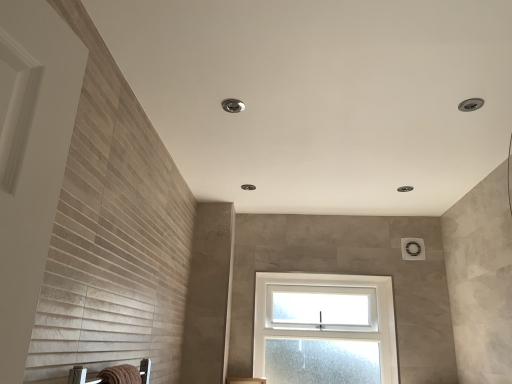
The height and width of the screenshot is (384, 512). What do you see at coordinates (325, 314) in the screenshot?
I see `clear glass window at center` at bounding box center [325, 314].

The image size is (512, 384). I want to click on clear glass window at center, so click(x=325, y=314).

The image size is (512, 384). Describe the element at coordinates (120, 375) in the screenshot. I see `brown textured towel at lower left` at that location.

You are a GUI agent. You are given a task and a screenshot of the screen. Output one action in this format:
    pyautogui.click(x=<x>, y=<y>)
    Task: Click on the brown textured towel at lower left
    The width and height of the screenshot is (512, 384).
    Given the screenshot: What is the action you would take?
    pyautogui.click(x=120, y=375)

Locate an element on the screen. The image size is (512, 384). clear glass window at center is located at coordinates (325, 314).

In the image, is brown textured towel at lower left on the left side or the right side of clear glass window at center?

brown textured towel at lower left is to the left of clear glass window at center.

Is brown textured towel at lower left behind clear glass window at center?

No, brown textured towel at lower left is in front of clear glass window at center.

Considering the points (110, 374) and (375, 278), which point is in front, point (110, 374) or point (375, 278)?

The point (110, 374) is closer to the camera.

From the image's perspective, which one is positioned higher, brown textured towel at lower left or clear glass window at center?

brown textured towel at lower left.

From a real-world perspective, relative to clear glass window at center, is brown textured towel at lower left vertically above or below?

In terms of real-world spatial position, brown textured towel at lower left is below clear glass window at center.

In terms of width, does brown textured towel at lower left look wider or thinner when compared to clear glass window at center?

Clearly, brown textured towel at lower left has less width compared to clear glass window at center.

Does brown textured towel at lower left have a lesser height compared to clear glass window at center?

Yes, brown textured towel at lower left is shorter than clear glass window at center.

Is brown textured towel at lower left bigger or smaller than clear glass window at center?

Considering their sizes, brown textured towel at lower left takes up less space than clear glass window at center.

Is brown textured towel at lower left inside the boundaries of clear glass window at center, or outside?

brown textured towel at lower left lies outside clear glass window at center.

Are brown textured towel at lower left and clear glass window at center beside each other?

No, brown textured towel at lower left is not in contact with clear glass window at center.

Is brown textured towel at lower left oriented towards clear glass window at center?

No, brown textured towel at lower left is not facing towards clear glass window at center.

How many degrees apart are the facing directions of brown textured towel at lower left and clear glass window at center?

89.2 degrees.

Based on the photo, measure the distance from brown textured towel at lower left to clear glass window at center.

A distance of 5.81 feet exists between brown textured towel at lower left and clear glass window at center.

Where is `bath towel on the left of clear glass window at center`? bath towel on the left of clear glass window at center is located at coordinates pos(120,375).

Is clear glass window at center to the left of brown textured towel at lower left from the viewer's perspective?

No.

Which object is closer to the camera taking this photo, clear glass window at center or brown textured towel at lower left?

brown textured towel at lower left is closer to the camera.

Is point (301, 338) farther from viewer compared to point (138, 383)?

That is True.

From the image's perspective, which is below, clear glass window at center or brown textured towel at lower left?

From the image's view, clear glass window at center is below.

From a real-world perspective, is clear glass window at center physically located above or below brown textured towel at lower left?

clear glass window at center is situated higher than brown textured towel at lower left in the real world.

Can you confirm if clear glass window at center is wider than brown textured towel at lower left?

Yes.

Considering the relative sizes of clear glass window at center and brown textured towel at lower left in the image provided, is clear glass window at center taller than brown textured towel at lower left?

Yes, clear glass window at center is taller than brown textured towel at lower left.

Is clear glass window at center bigger or smaller than brown textured towel at lower left?

In the image, clear glass window at center appears to be larger than brown textured towel at lower left.

From the picture: Do you think clear glass window at center is within brown textured towel at lower left, or outside of it?

clear glass window at center is located beyond the bounds of brown textured towel at lower left.

Can you see clear glass window at center touching brown textured towel at lower left?

No.

Is clear glass window at center facing away from brown textured towel at lower left?

clear glass window at center is not turned away from brown textured towel at lower left.

Measure the distance between clear glass window at center and brown textured towel at lower left.

clear glass window at center and brown textured towel at lower left are 5.81 feet apart from each other.

Locate an element on the screen. This screenshot has height=384, width=512. bath towel that appears above the clear glass window at center (from the image's perspective) is located at coordinates (120, 375).

Identify the location of bath towel on the left side of clear glass window at center. (120, 375).

The image size is (512, 384). Find the location of `bath towel below the clear glass window at center (from a real-world perspective)`. bath towel below the clear glass window at center (from a real-world perspective) is located at coordinates (120, 375).